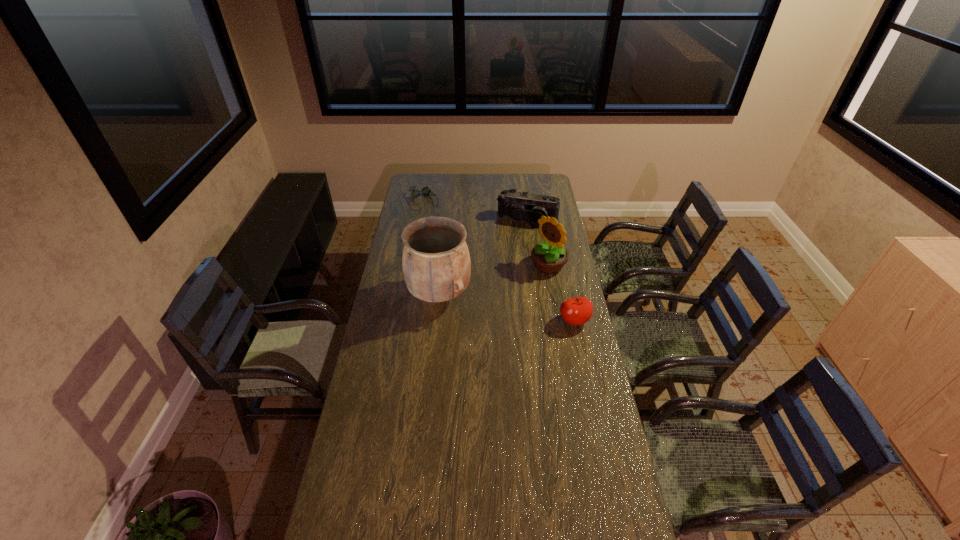
This screenshot has width=960, height=540. In order to click on vacant point located between the camcorder and the spectacles in this screenshot , I will do `click(475, 210)`.

Identify the location of free area in between the apple and the sunflower. (562, 293).

You are a GUI agent. You are given a task and a screenshot of the screen. Output one action in this format:
    pyautogui.click(x=<x>, y=<y>)
    Task: Click on the vacant area between the fourth tallest object and the urn
    This screenshot has width=960, height=540.
    Given the screenshot: What is the action you would take?
    pyautogui.click(x=507, y=308)

You are a GUI agent. You are given a task and a screenshot of the screen. Output one action in this format:
    pyautogui.click(x=<x>, y=<y>)
    Task: Click on the free spot between the tallest object and the second shortest object
    
    Given the screenshot: What is the action you would take?
    pyautogui.click(x=507, y=308)

What are the coordinates of `free area in between the urn and the camcorder` in the screenshot? It's located at (483, 256).

Locate an element on the screen. The image size is (960, 540). free spot between the sunflower and the urn is located at coordinates (493, 280).

You are a GUI agent. You are given a task and a screenshot of the screen. Output one action in this format:
    pyautogui.click(x=<x>, y=<y>)
    Task: Click on the blank region between the second tallest object and the apple
    The width and height of the screenshot is (960, 540).
    Given the screenshot: What is the action you would take?
    pyautogui.click(x=562, y=293)

You are a GUI agent. You are given a task and a screenshot of the screen. Output one action in this format:
    pyautogui.click(x=<x>, y=<y>)
    Task: Click on the free spot between the sunflower and the camcorder
    
    Given the screenshot: What is the action you would take?
    pyautogui.click(x=538, y=242)

Where is `object that stands as the fourth closest to the camcorder`? The height and width of the screenshot is (540, 960). object that stands as the fourth closest to the camcorder is located at coordinates (575, 311).

The image size is (960, 540). What are the coordinates of `the third closest object to the second shortest object` in the screenshot? It's located at (524, 206).